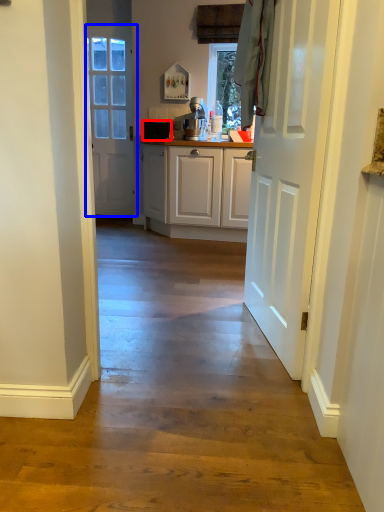
Question: Which object appears closest to the camera in this image, appliance (highlighted by a red box) or door (highlighted by a blue box)?

Choices:
 (A) appliance
 (B) door

Answer: (A)